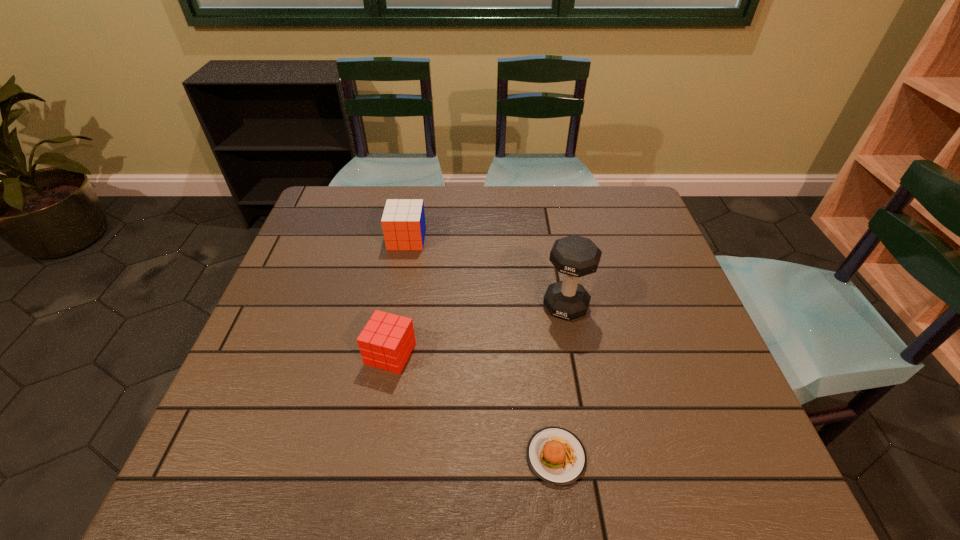
Locate an element on the screen. object that stands as the second closest to the tallest object is located at coordinates point(386,342).

Locate which object is the closest to the food. Please provide its 2D coordinates. Your answer should be formatted as a tuple, i.e. [(x, y)], where the tuple contains the x and y coordinates of a point satisfying the conditions above.

[(386, 342)]

Locate an element on the screen. The width and height of the screenshot is (960, 540). free space that satisfies the following two spatial constraints: 1. on the back side of the tallest object; 2. on the right side of the third tallest object is located at coordinates (399, 306).

The image size is (960, 540). I want to click on free space in the image that satisfies the following two spatial constraints: 1. on the back side of the second shortest object; 2. on the right side of the second farthest object, so click(399, 306).

Find the location of a particular element. The height and width of the screenshot is (540, 960). blank space that satisfies the following two spatial constraints: 1. on the front side of the farthest object; 2. on the left side of the dumbbell is located at coordinates (x=395, y=306).